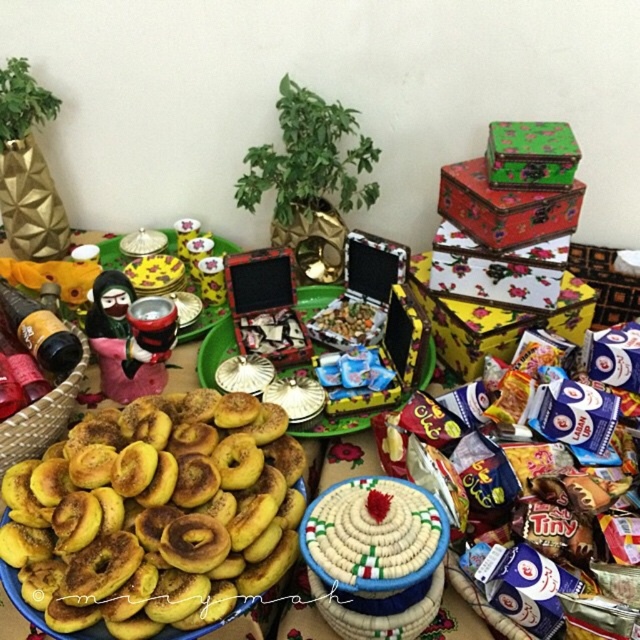
You are standing in front of the colorful display of traditional treats and decor. You see two points marked in the image. The first point is at coordinates point [524,138] and the second point is at point [356,305]. Which point is closer to you?

Point [524,138] is in front of point [356,305], so the first point is closer to you.